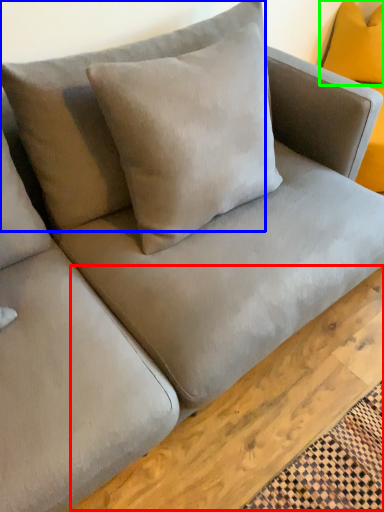
Question: Which is nearer to the plank (highlighted by a red box)? pillow (highlighted by a blue box) or pillow (highlighted by a green box).

Choices:
 (A) pillow
 (B) pillow

Answer: (A)